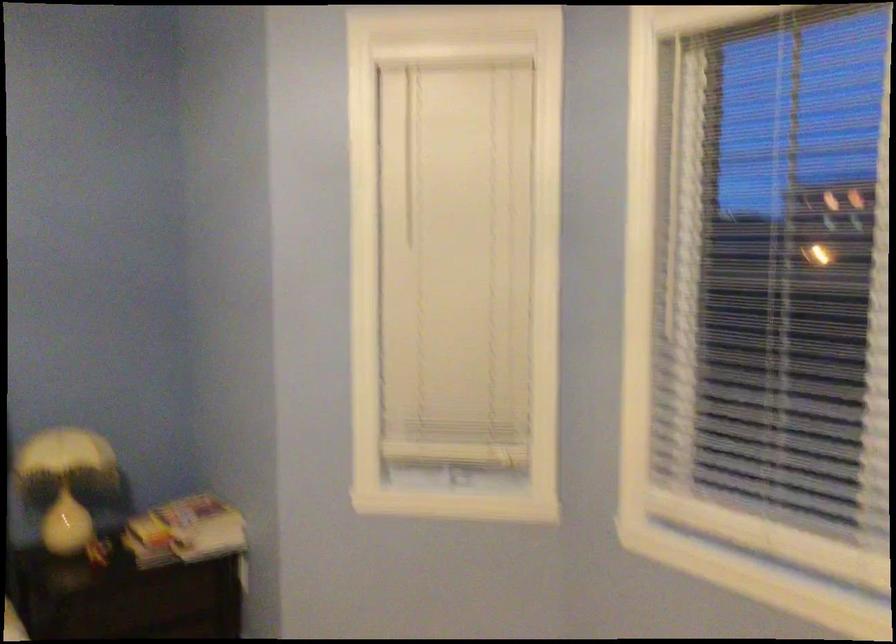
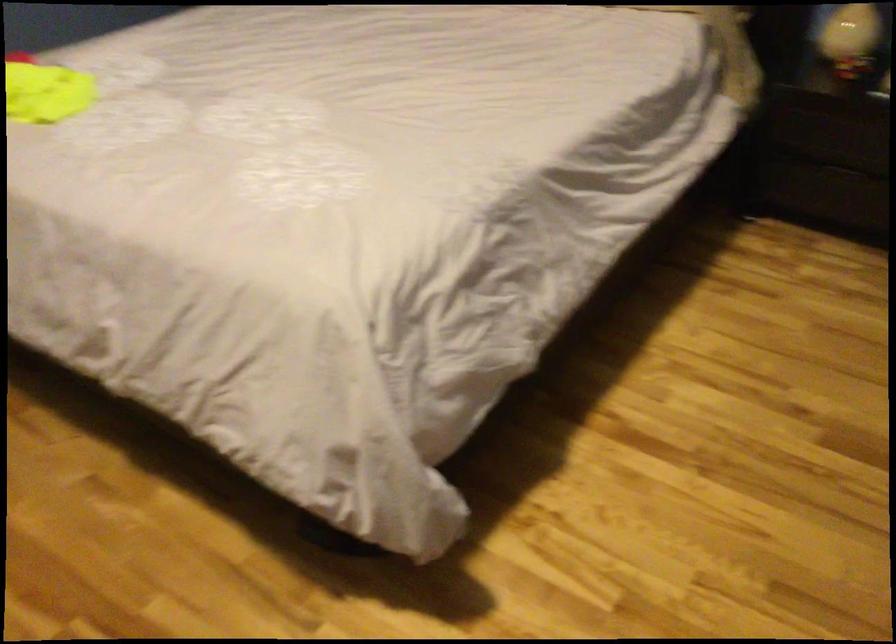
Where in the second image is the point corresponding to (x=90, y=531) from the first image?

(851, 39)